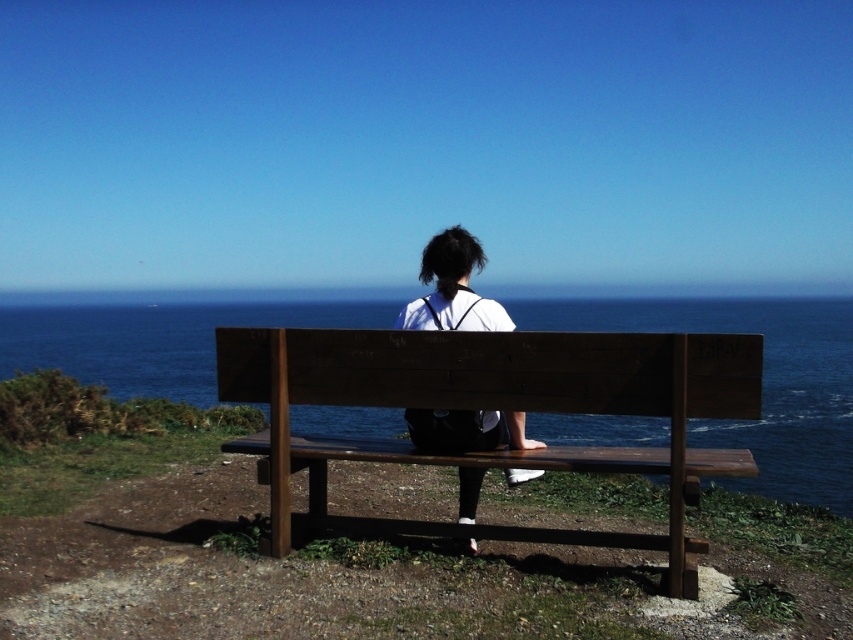
Question: Which is nearer to the brown wooden bench at center?

Choices:
 (A) blue water at center
 (B) white matte shirt at center

Answer: (B)

Question: From the image, what is the correct spatial relationship of blue water at center in relation to white matte shirt at center?

Choices:
 (A) below
 (B) above

Answer: (B)

Question: Does blue water at center appear on the right side of white matte shirt at center?

Choices:
 (A) no
 (B) yes

Answer: (B)

Question: Among these points, which one is nearest to the camera?

Choices:
 (A) (490, 401)
 (B) (595, 420)
 (C) (450, 426)

Answer: (A)

Question: Does blue water at center appear under white matte shirt at center?

Choices:
 (A) no
 (B) yes

Answer: (A)

Question: Which object is positioned farthest from the blue water at center?

Choices:
 (A) white matte shirt at center
 (B) brown wooden bench at center

Answer: (A)